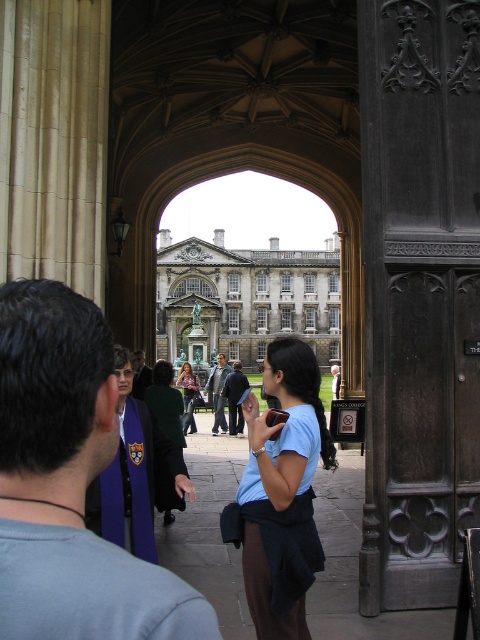
You are standing in front of an ornate arched doorway leading to a courtyard. You want to take a photo of the point at coordinates point (126, 593). Given that your camera has a maximum focus range of 80 meters, will you be able to focus on that point?

The distance of point (126, 593) from the camera is 88.68 meters, which exceeds the camera maximum focus range of 80 meters. Therefore, the camera cannot focus on that point.

You are standing in the courtyard and want to walk from the ornate arched doorway to the statue in front of the building. There are two points marked on the path. Which point should you reach first, point [153,618] or point [196,381]?

Point [153,618] is in front of point [196,381], so you should reach point [153,618] first as it is closer to your starting position at the doorway.